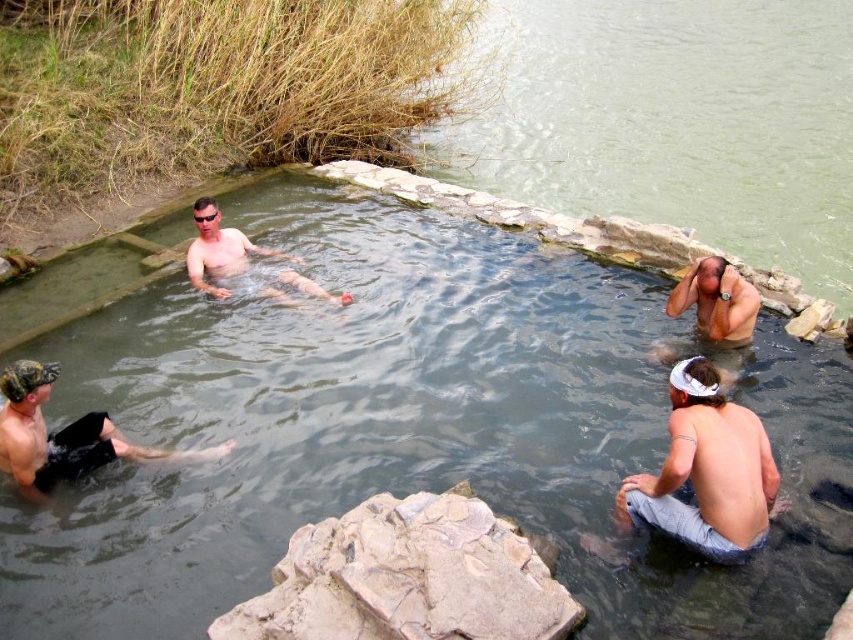
You are a photographer standing at the edge of the hot spring. You want to capture a photo that includes both the rough textured rock at center and the gray denim shorts at lower right. Which object should you adjust your camera angle to focus on first if you want to ensure both are in the frame?

The rough textured rock at center is shorter than the gray denim shorts at lower right. To ensure both are in the frame, focus on the shorter object first, which is the rough textured rock at center, then adjust to include the taller gray denim shorts at lower right.

You are standing at the edge of the scene and want to step into the clear stone pool at center. Based on the distance provided, how many steps would you need to take if each step covers approximately 0.75 meters?

The clear stone pool at center is 4.81 meters away from the viewer. Since each step covers about 0.75 meters, dividing 4.81 by 0.75 gives approximately 6.41 steps. Therefore, you would need to take 7 steps to reach the clear stone pool at center.

You are designing a layout for a new hot spring area and need to place a decorative rock and a bench. The rough textured rock at center must be placed where it doesn t take up too much space, and the bench will be near the gray denim shorts at lower right. Based on the scene, is the rock s current placement suitable for your design?

The rough textured rock at center occupies less space than the gray denim shorts at lower right, so its current placement is suitable for the design as it doesn t take up too much space.